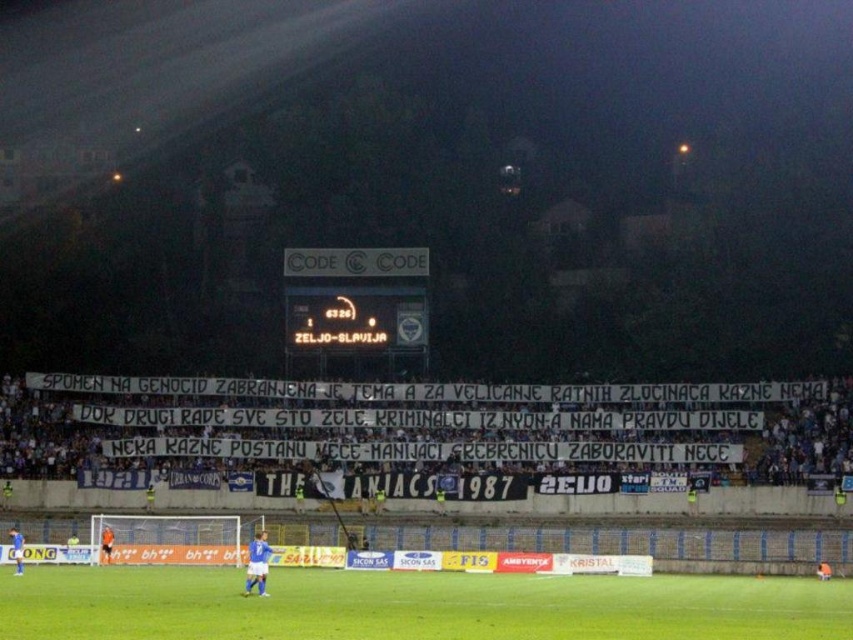
You are a photographer positioned at the center of the soccer field. You want to capture a photo of the white fabric banner at center. Based on its location, will the banner be in the foreground or midground of your photo?

The white fabric banner at center is located at point [410,440], which places it in the midground of the photo.

You are a photographer at the soccer stadium. You want to capture a photo that includes both the white fabric banner at center and the green grass field at center. Based on their positions, which object should be placed on the right side of your photo?

The white fabric banner at center is positioned on the right side of green grass field at center, so in the photo, the white fabric banner at center should be on the right side.

You are a photographer standing at the edge of the soccer field. You want to take a photo that includes both the white fabric banner at center and the green grass field at center. Which object will appear larger in your photo?

The white fabric banner at center will appear larger in the photo because it is closer to the photographer than the green grass field at center.